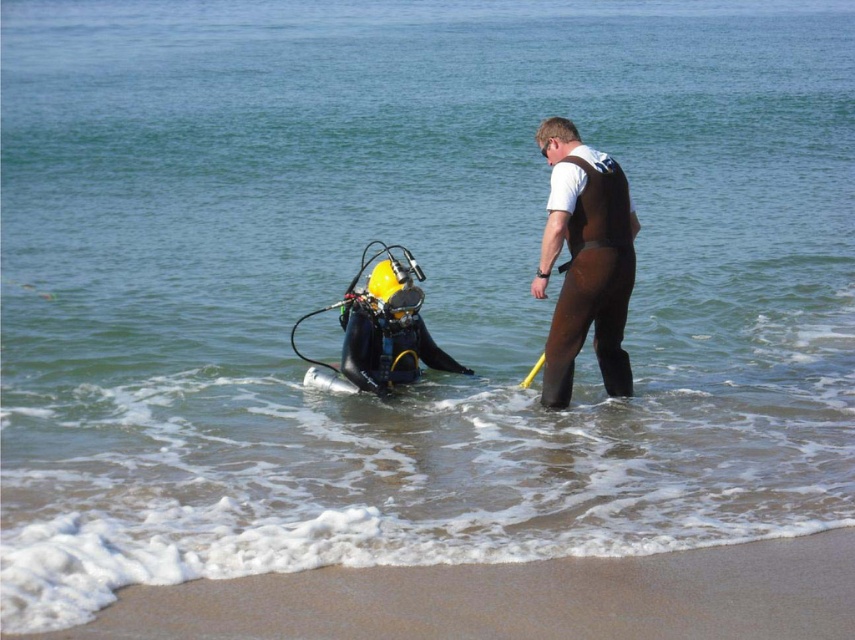
Question: Can you confirm if sandy beach at lower left is positioned below brown matte wetsuit at center?

Choices:
 (A) yes
 (B) no

Answer: (A)

Question: Which point is farther from the camera taking this photo?

Choices:
 (A) (616, 310)
 (B) (852, 561)

Answer: (A)

Question: Among these objects, which one is farthest from the camera?

Choices:
 (A) sandy beach at lower left
 (B) brown matte wetsuit at center

Answer: (B)

Question: From the image, what is the correct spatial relationship of sandy beach at lower left in relation to brown matte wetsuit at center?

Choices:
 (A) right
 (B) left

Answer: (B)

Question: Can you confirm if sandy beach at lower left is thinner than brown matte wetsuit at center?

Choices:
 (A) yes
 (B) no

Answer: (B)